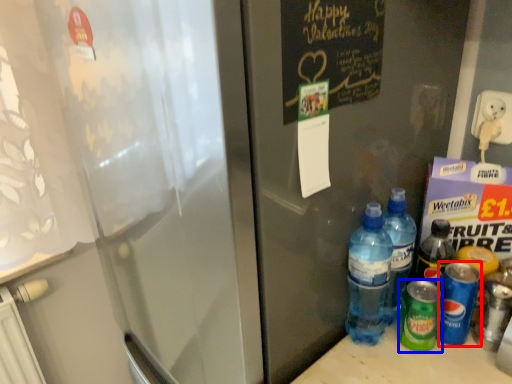
Question: Which object is further to the camera taking this photo, bottle (highlighted by a red box) or bottle (highlighted by a blue box)?

Choices:
 (A) bottle
 (B) bottle

Answer: (B)